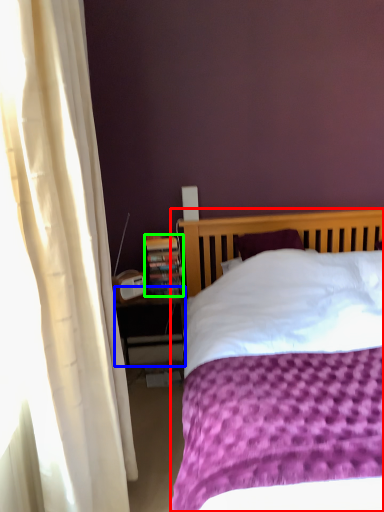
Question: Estimate the real-world distances between objects in this image. Which object is closer to bed (highlighted by a red box), nightstand (highlighted by a blue box) or paperback book (highlighted by a green box)?

Choices:
 (A) nightstand
 (B) paperback book

Answer: (B)